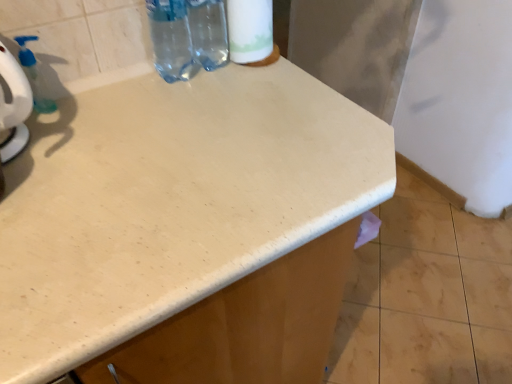
Question: Should I look upward or downward to see white matte toilet paper at upper center?

Choices:
 (A) down
 (B) up

Answer: (B)

Question: From the image's perspective, is transparent plastic bottle at upper center, arranged as the second bottle when viewed from the left, over transparent plastic bottle at upper center, the first bottle viewed from the left?

Choices:
 (A) no
 (B) yes

Answer: (B)

Question: From a real-world perspective, is transparent plastic bottle at upper center, which is counted as the 1th bottle, starting from the right, physically below transparent plastic bottle at upper center, which is the second bottle in right-to-left order?

Choices:
 (A) no
 (B) yes

Answer: (A)

Question: Is transparent plastic bottle at upper center, which is counted as the 1th bottle, starting from the right, smaller than transparent plastic bottle at upper center, which is the second bottle in right-to-left order?

Choices:
 (A) no
 (B) yes

Answer: (A)

Question: Does transparent plastic bottle at upper center, which is counted as the 1th bottle, starting from the right, have a lesser height compared to transparent plastic bottle at upper center, which is the second bottle in right-to-left order?

Choices:
 (A) yes
 (B) no

Answer: (B)

Question: Is transparent plastic bottle at upper center, the first bottle viewed from the left, surrounded by transparent plastic bottle at upper center, which is counted as the 1th bottle, starting from the right?

Choices:
 (A) yes
 (B) no

Answer: (A)

Question: Can you confirm if transparent plastic bottle at upper center, arranged as the second bottle when viewed from the left, is taller than transparent plastic bottle at upper center, the first bottle viewed from the left?

Choices:
 (A) yes
 (B) no

Answer: (A)

Question: Is white matte toilet paper at upper center wider than transparent plastic bottle at upper center, the first bottle viewed from the left?

Choices:
 (A) yes
 (B) no

Answer: (A)

Question: Is white matte toilet paper at upper center outside transparent plastic bottle at upper center, which is the second bottle in right-to-left order?

Choices:
 (A) no
 (B) yes

Answer: (B)

Question: From a real-world perspective, is white matte toilet paper at upper center over transparent plastic bottle at upper center, which is the second bottle in right-to-left order?

Choices:
 (A) yes
 (B) no

Answer: (A)

Question: Could transparent plastic bottle at upper center, the first bottle viewed from the left, be considered to be inside white matte toilet paper at upper center?

Choices:
 (A) no
 (B) yes

Answer: (A)

Question: Does white matte toilet paper at upper center appear on the right side of transparent plastic bottle at upper center, the first bottle viewed from the left?

Choices:
 (A) no
 (B) yes

Answer: (B)

Question: Can you confirm if white matte toilet paper at upper center is positioned to the left of transparent plastic bottle at upper center, the first bottle viewed from the left?

Choices:
 (A) no
 (B) yes

Answer: (A)

Question: Can you confirm if transparent plastic bottle at upper center, which is the second bottle in right-to-left order, is positioned to the right of transparent plastic soap dispenser at upper left?

Choices:
 (A) yes
 (B) no

Answer: (A)